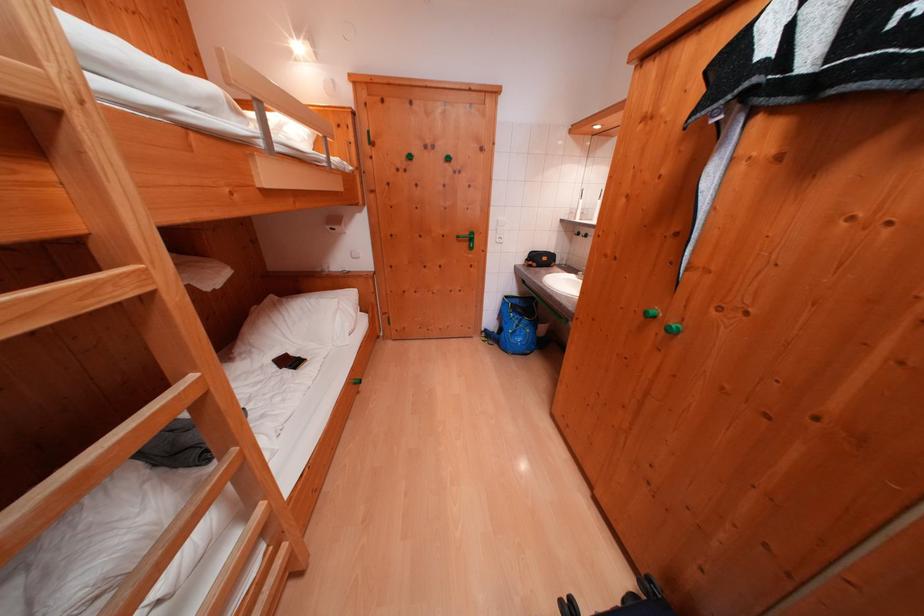
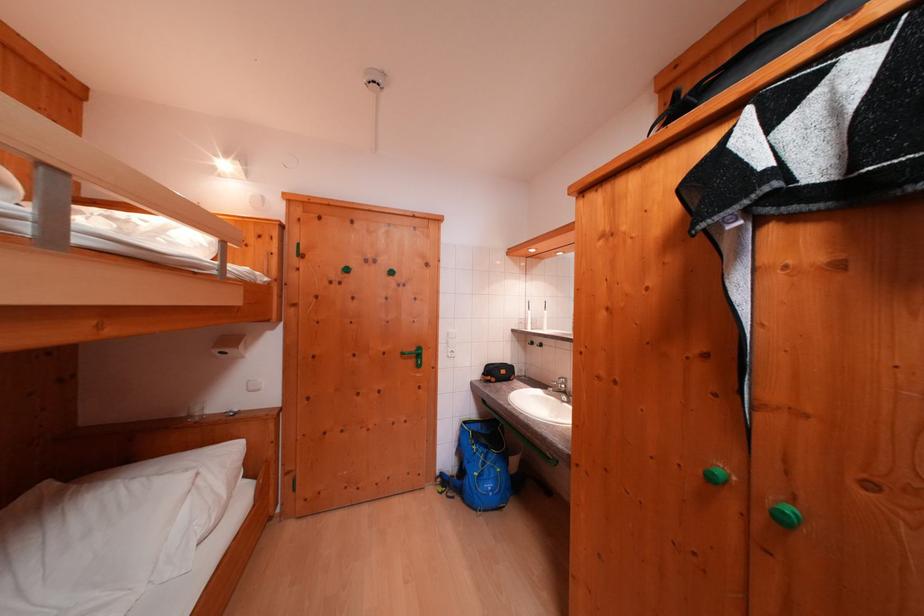
Question: Which direction would the cameraman need to move to produce the second image? Reply with the corresponding letter.

Choices:
 (A) Left
 (B) Right
 (C) Forward
 (D) Backward

Answer: (C)